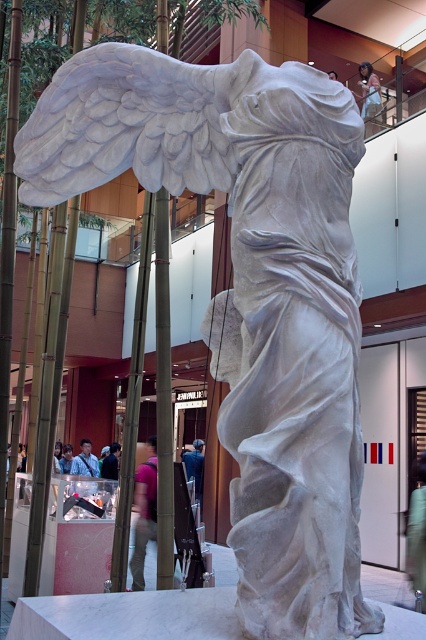
Who is more forward, (138, 563) or (377, 77)?

Point (138, 563)

Does pink fabric pants at center have a lesser width compared to light brown wooden chair at upper center?

Yes, pink fabric pants at center is thinner than light brown wooden chair at upper center.

The height and width of the screenshot is (640, 426). What do you see at coordinates (143, 513) in the screenshot? I see `pink fabric pants at center` at bounding box center [143, 513].

Locate an element on the screen. pink fabric pants at center is located at coordinates (143, 513).